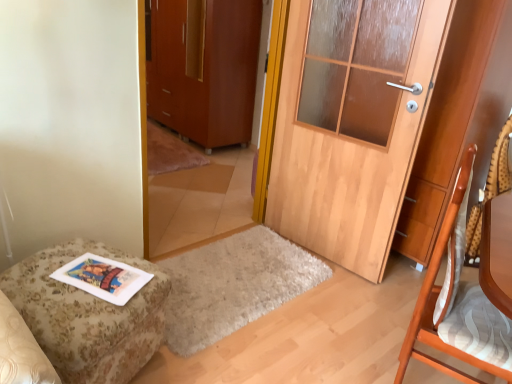
Question: Considering the positions of wooden chair at right and matte brown cabinet at center in the image, is wooden chair at right bigger or smaller than matte brown cabinet at center?

Choices:
 (A) big
 (B) small

Answer: (B)

Question: Is wooden chair at right taller or shorter than matte brown cabinet at center?

Choices:
 (A) short
 (B) tall

Answer: (A)

Question: Estimate the real-world distances between objects in this image. Which object is closer to the wooden door at center?

Choices:
 (A) wooden textured swivel chair at right
 (B) wooden chair at right
 (C) floral fabric ottoman at lower left
 (D) matte brown cabinet at center

Answer: (B)

Question: Estimate the real-world distances between objects in this image. Which object is farther from the matte brown cabinet at center?

Choices:
 (A) wooden chair at right
 (B) wooden textured swivel chair at right
 (C) floral fabric ottoman at lower left
 (D) wooden door at center

Answer: (A)